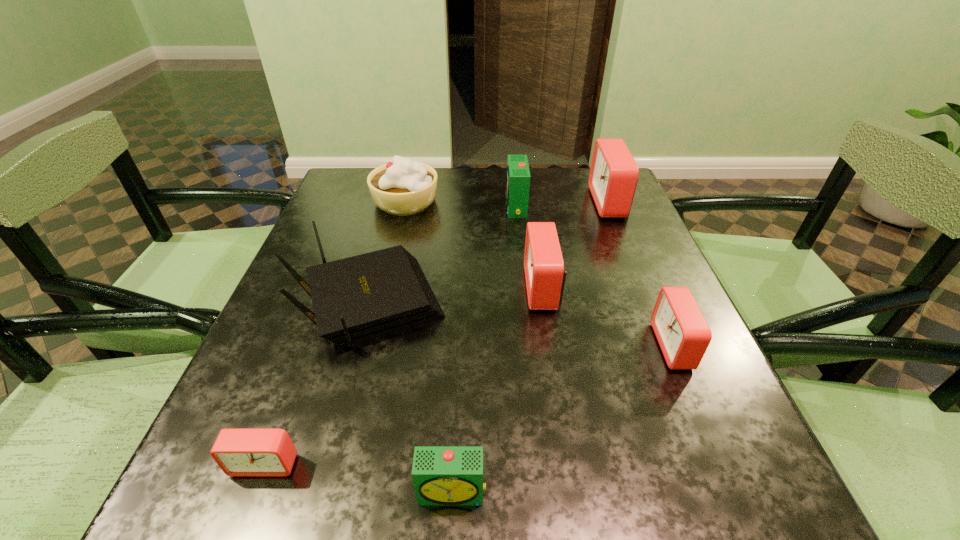
Locate which object ranks fourth in proximity to the shortest alarm clock. Please provide its 2D coordinates. Your answer should be formatted as a tuple, i.e. [(x, y)], where the tuple contains the x and y coordinates of a point satisfying the conditions above.

[(683, 334)]

Locate which object ranks seventh in proximity to the tallest alarm clock. Please provide its 2D coordinates. Your answer should be formatted as a tuple, i.e. [(x, y)], where the tuple contains the x and y coordinates of a point satisfying the conditions above.

[(239, 452)]

Identify which alarm clock is the second closest to the right green alarm clock. Please provide its 2D coordinates. Your answer should be formatted as a tuple, i.e. [(x, y)], where the tuple contains the x and y coordinates of a point satisfying the conditions above.

[(545, 274)]

The width and height of the screenshot is (960, 540). Identify the location of alarm clock that can be found as the third closest to the second farthest red alarm clock. (613, 175).

I want to click on the second closest red alarm clock relative to the leftmost red alarm clock, so click(x=683, y=334).

This screenshot has width=960, height=540. What are the coordinates of `red alarm clock that can be found as the third closest to the tallest alarm clock` in the screenshot? It's located at (239, 452).

Image resolution: width=960 pixels, height=540 pixels. Identify the location of free spot that satisfies the following two spatial constraints: 1. on the front-facing side of the fourth farthest alarm clock; 2. on the front-facing side of the nearer green alarm clock. (736, 492).

You are a GUI agent. You are given a task and a screenshot of the screen. Output one action in this format:
    pyautogui.click(x=<x>, y=<y>)
    Task: Click on the free space that satisfies the following two spatial constraints: 1. on the front-facing side of the third farthest red alarm clock; 2. on the front-facing side of the shortest alarm clock
    This screenshot has height=540, width=960.
    Given the screenshot: What is the action you would take?
    pyautogui.click(x=724, y=463)

I want to click on free space that satisfies the following two spatial constraints: 1. on the front-facing side of the second farthest red alarm clock; 2. on the front-facing side of the fifth alarm clock from right to left, so click(x=575, y=492).